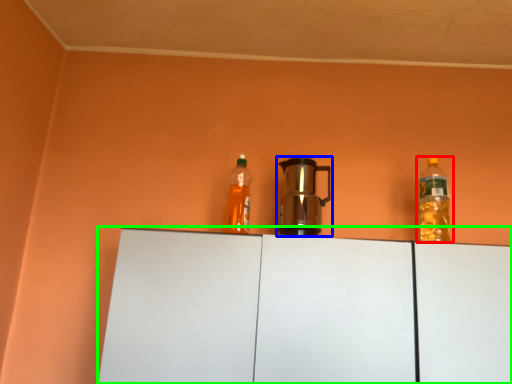
Question: Which is farther away from bottle (highlighted by a red box)? kitchen appliance (highlighted by a blue box) or cabinetry (highlighted by a green box)?

Choices:
 (A) kitchen appliance
 (B) cabinetry

Answer: (B)